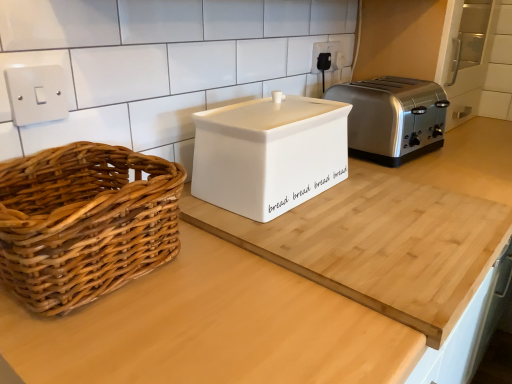
Question: From the image's perspective, is white matte bread bin at center above satin silver toaster at right?

Choices:
 (A) no
 (B) yes

Answer: (A)

Question: Considering the relative sizes of white matte bread bin at center and satin silver toaster at right in the image provided, is white matte bread bin at center smaller than satin silver toaster at right?

Choices:
 (A) yes
 (B) no

Answer: (B)

Question: Does white matte bread bin at center come in front of satin silver toaster at right?

Choices:
 (A) no
 (B) yes

Answer: (B)

Question: Is white matte bread bin at center thinner than satin silver toaster at right?

Choices:
 (A) no
 (B) yes

Answer: (A)

Question: Considering the relative sizes of white matte bread bin at center and satin silver toaster at right in the image provided, is white matte bread bin at center wider than satin silver toaster at right?

Choices:
 (A) yes
 (B) no

Answer: (A)

Question: Is white matte bread bin at center taller or shorter than woven wood picnic basket at left?

Choices:
 (A) tall
 (B) short

Answer: (A)

Question: Relative to woven wood picnic basket at left, is white matte bread bin at center in front or behind?

Choices:
 (A) front
 (B) behind

Answer: (A)

Question: Is point (130, 284) closer or farther from the camera than point (111, 152)?

Choices:
 (A) farther
 (B) closer

Answer: (B)

Question: Is white matte bread bin at center inside the boundaries of woven wood picnic basket at left, or outside?

Choices:
 (A) outside
 (B) inside

Answer: (A)

Question: Looking at their shapes, would you say woven wood picnic basket at left is wider or thinner than white matte bread bin at center?

Choices:
 (A) wide
 (B) thin

Answer: (B)

Question: Considering their positions, is woven wood picnic basket at left located in front of or behind white matte bread bin at center?

Choices:
 (A) front
 (B) behind

Answer: (B)

Question: From their relative heights in the image, would you say woven wood picnic basket at left is taller or shorter than white matte bread bin at center?

Choices:
 (A) short
 (B) tall

Answer: (A)

Question: From the image's perspective, is woven wood picnic basket at left located above or below white matte bread bin at center?

Choices:
 (A) below
 (B) above

Answer: (B)

Question: Is white matte bread bin at center bigger or smaller than white plastic electrical outlet at upper center?

Choices:
 (A) small
 (B) big

Answer: (B)

Question: Would you say white matte bread bin at center is inside or outside white plastic electrical outlet at upper center?

Choices:
 (A) inside
 (B) outside

Answer: (B)